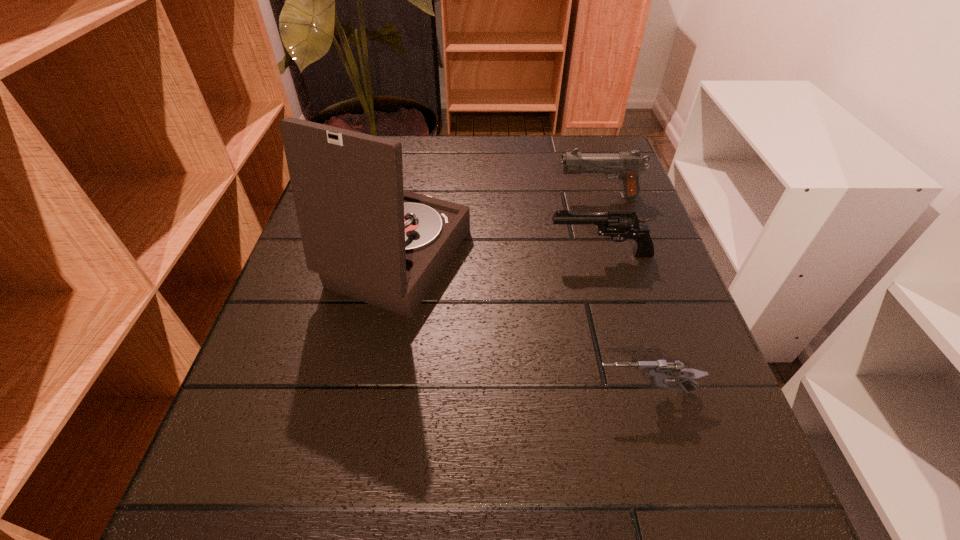
The height and width of the screenshot is (540, 960). I want to click on gun object that ranks as the closest to the shortest gun, so click(x=619, y=225).

Identify which gun is the closest to the second farthest gun. Please provide its 2D coordinates. Your answer should be formatted as a tuple, i.e. [(x, y)], where the tuple contains the x and y coordinates of a point satisfying the conditions above.

[(627, 165)]